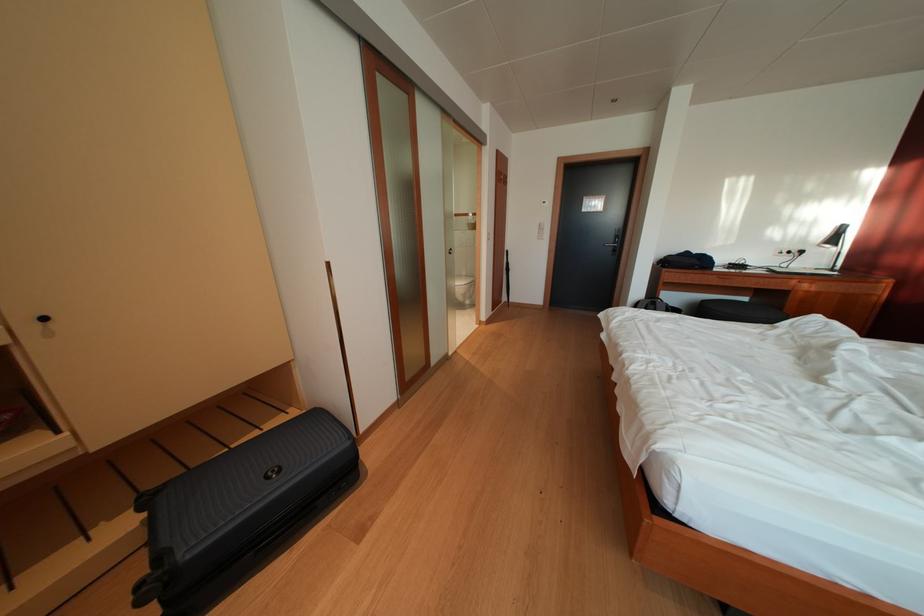
Locate an element on the screen. toilet flush button is located at coordinates (465, 238).